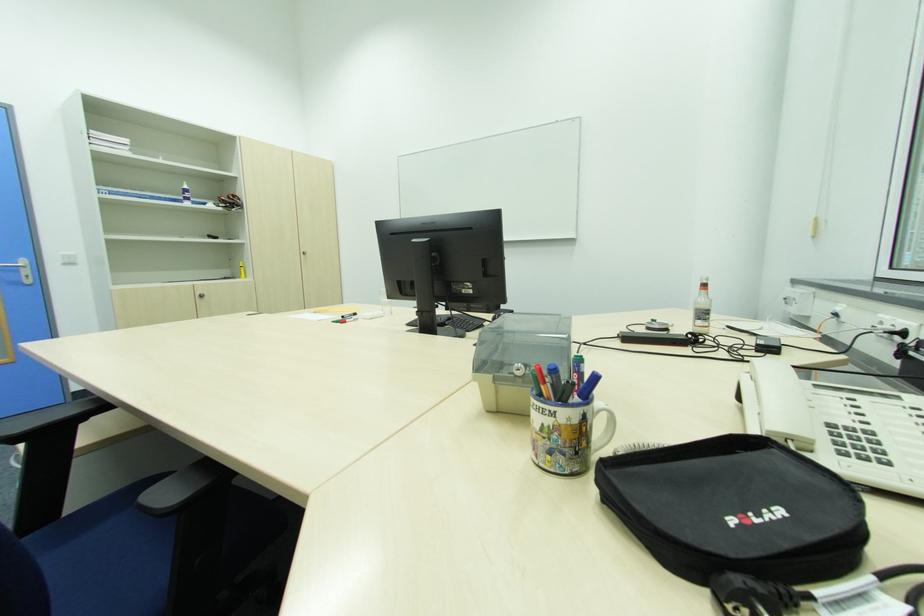
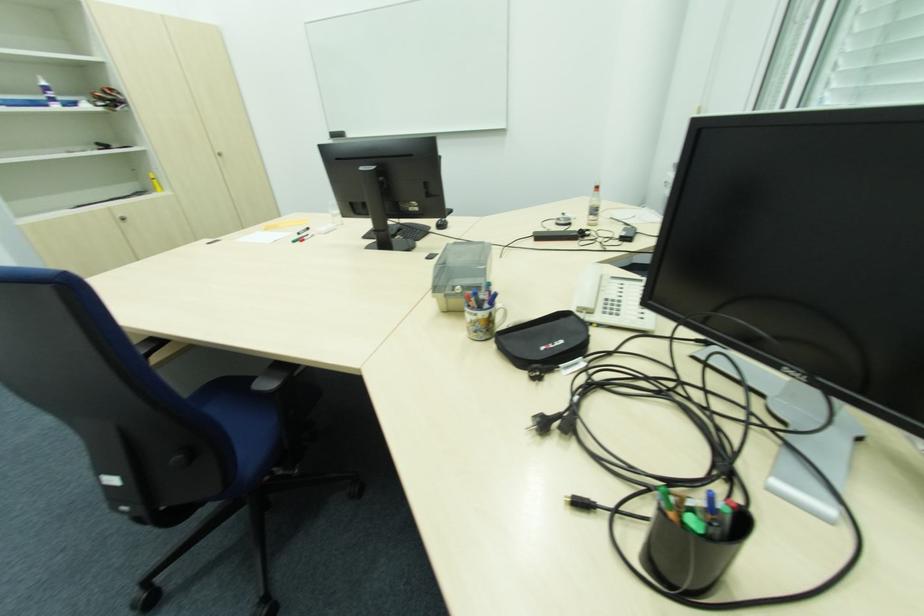
Where in the second image is the point corresponding to pixel 702 323 from the first image?

(594, 217)